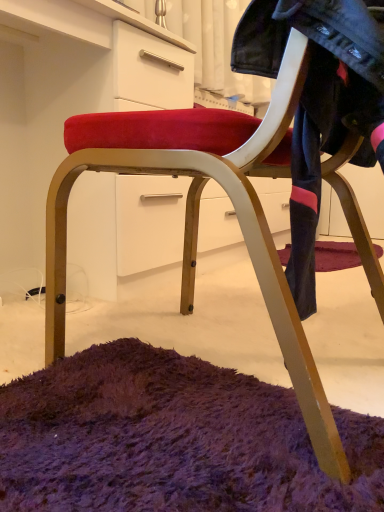
Question: Is denim jacket at upper right behind matte white dresser at center?

Choices:
 (A) yes
 (B) no

Answer: (B)

Question: Considering the relative sizes of denim jacket at upper right and matte white dresser at center in the image provided, is denim jacket at upper right thinner than matte white dresser at center?

Choices:
 (A) no
 (B) yes

Answer: (B)

Question: Considering the relative sizes of denim jacket at upper right and matte white dresser at center in the image provided, is denim jacket at upper right bigger than matte white dresser at center?

Choices:
 (A) yes
 (B) no

Answer: (B)

Question: Does denim jacket at upper right have a smaller size compared to matte white dresser at center?

Choices:
 (A) no
 (B) yes

Answer: (B)

Question: Is denim jacket at upper right positioned with its back to matte white dresser at center?

Choices:
 (A) no
 (B) yes

Answer: (A)

Question: Considering the relative sizes of denim jacket at upper right and matte white dresser at center in the image provided, is denim jacket at upper right wider than matte white dresser at center?

Choices:
 (A) yes
 (B) no

Answer: (B)

Question: Can you confirm if matte white dresser at center is bigger than denim jacket at upper right?

Choices:
 (A) yes
 (B) no

Answer: (A)

Question: From a real-world perspective, is matte white dresser at center physically below denim jacket at upper right?

Choices:
 (A) yes
 (B) no

Answer: (A)

Question: Are matte white dresser at center and denim jacket at upper right beside each other?

Choices:
 (A) no
 (B) yes

Answer: (A)

Question: Is matte white dresser at center positioned behind denim jacket at upper right?

Choices:
 (A) yes
 (B) no

Answer: (A)

Question: From a real-world perspective, does matte white dresser at center stand above denim jacket at upper right?

Choices:
 (A) no
 (B) yes

Answer: (A)

Question: Would you say matte white dresser at center contains denim jacket at upper right?

Choices:
 (A) no
 (B) yes

Answer: (A)

Question: Would you say matte white dresser at center is to the left or to the right of denim jacket at upper right in the picture?

Choices:
 (A) right
 (B) left

Answer: (B)